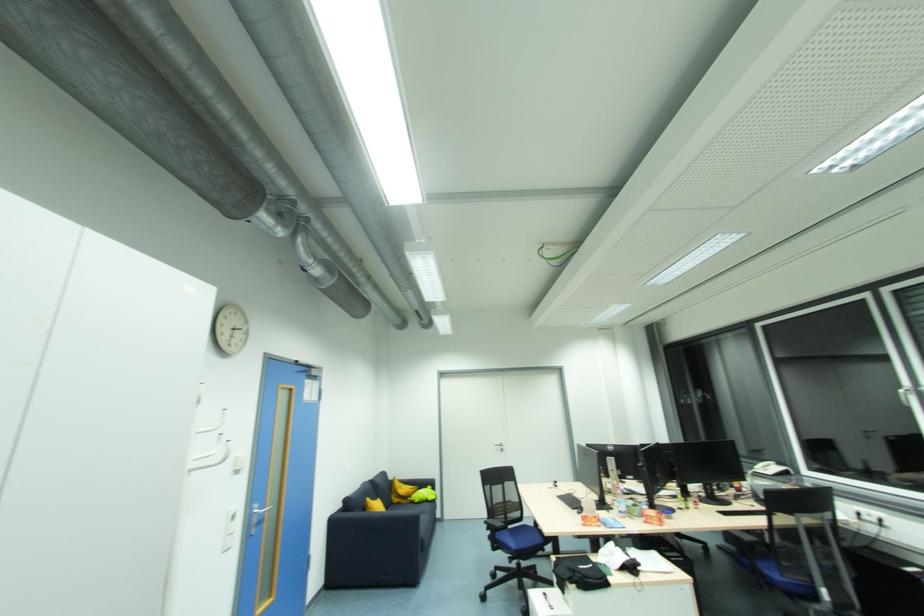
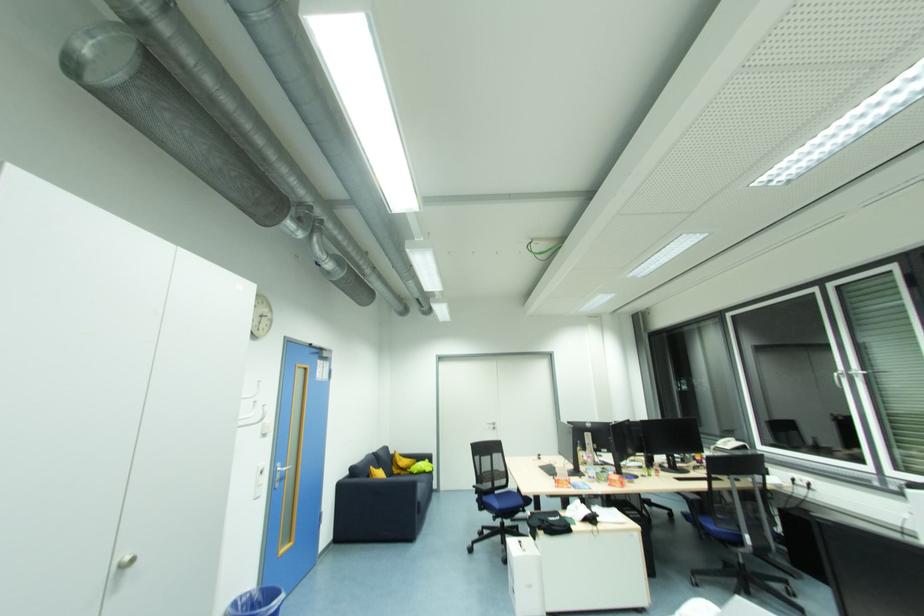
Question: I am providing you with two images of the same scene from different viewpoints. Please identify which objects are invisible in image2.

Choices:
 (A) chair back top rail
 (B) silver door handle
 (C) blue sofa armrest
 (D) none of these

Answer: (D)